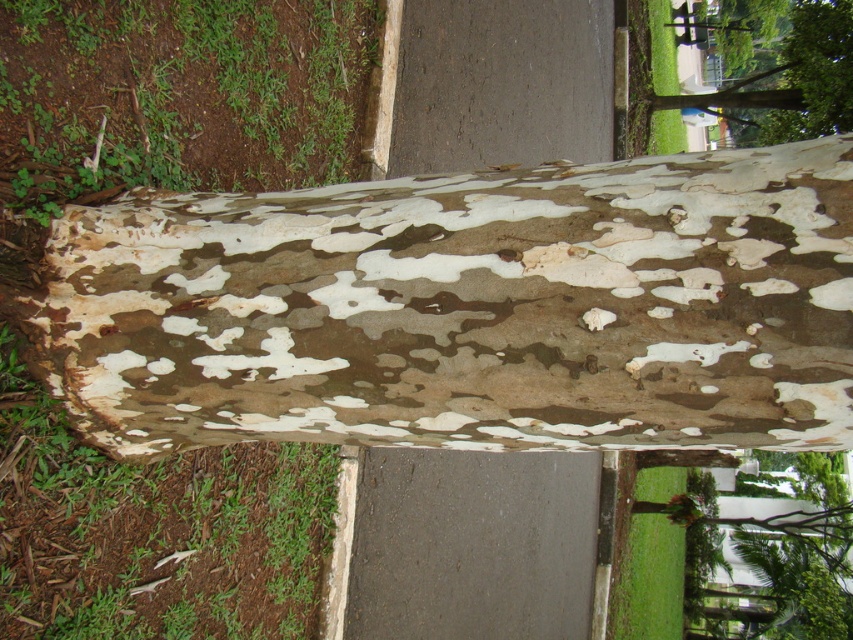
Question: Which point is closer to the camera?

Choices:
 (A) speckled bark tree trunk at center
 (B) camouflage bark tree at upper right

Answer: (A)

Question: Does speckled bark tree trunk at center have a lesser width compared to camouflage bark tree at upper right?

Choices:
 (A) no
 (B) yes

Answer: (B)

Question: Can you confirm if speckled bark tree trunk at center is wider than camouflage bark tree at upper right?

Choices:
 (A) no
 (B) yes

Answer: (A)

Question: Does speckled bark tree trunk at center come behind camouflage bark tree at upper right?

Choices:
 (A) no
 (B) yes

Answer: (A)

Question: Among these objects, which one is nearest to the camera?

Choices:
 (A) camouflage bark tree at upper right
 (B) speckled bark tree trunk at center

Answer: (B)